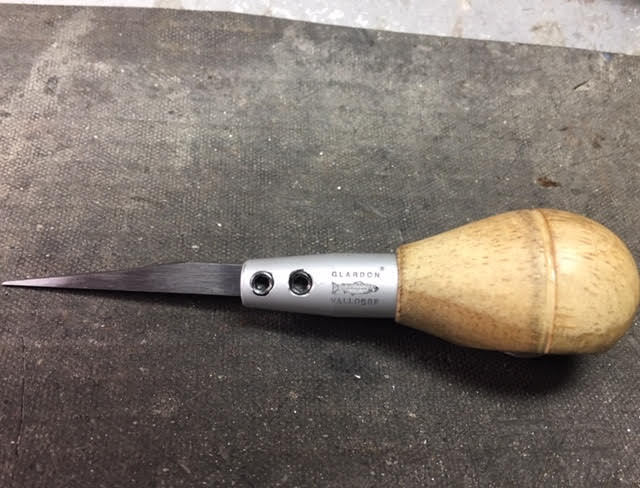
Identify the location of foam. Image resolution: width=640 pixels, height=488 pixels. (340, 404).